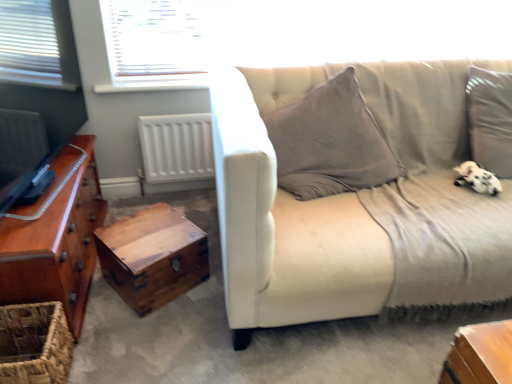
Image resolution: width=512 pixels, height=384 pixels. In order to click on vacant space that's between wooden chest at lower left and woven brown basket at lower left in this screenshot , I will do `click(115, 321)`.